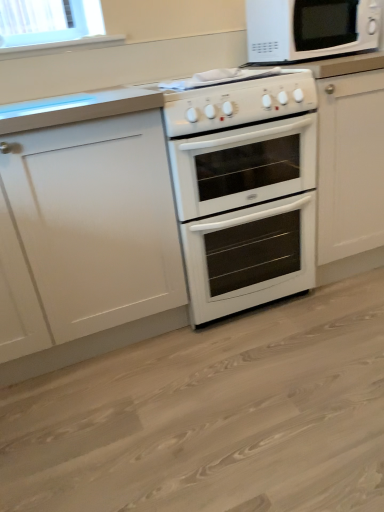
Question: Does white glossy gas stove at center have a lesser width compared to white glossy oven at center?

Choices:
 (A) no
 (B) yes

Answer: (B)

Question: From a real-world perspective, is white glossy gas stove at center physically below white glossy oven at center?

Choices:
 (A) no
 (B) yes

Answer: (A)

Question: Is white glossy gas stove at center located outside white glossy oven at center?

Choices:
 (A) no
 (B) yes

Answer: (B)

Question: Is white glossy gas stove at center far from white glossy oven at center?

Choices:
 (A) no
 (B) yes

Answer: (A)

Question: Can you confirm if white glossy gas stove at center is positioned to the right of white glossy oven at center?

Choices:
 (A) yes
 (B) no

Answer: (B)

Question: Considering the relative positions of white matte cabinet at left and white glossy oven at center in the image provided, is white matte cabinet at left to the left or to the right of white glossy oven at center?

Choices:
 (A) left
 (B) right

Answer: (A)

Question: From the image's perspective, is white matte cabinet at left located above or below white glossy oven at center?

Choices:
 (A) below
 (B) above

Answer: (A)

Question: Is white matte cabinet at left inside the boundaries of white glossy oven at center, or outside?

Choices:
 (A) outside
 (B) inside

Answer: (A)

Question: Considering the positions of point (135, 291) and point (258, 303), is point (135, 291) closer or farther from the camera than point (258, 303)?

Choices:
 (A) closer
 (B) farther

Answer: (A)

Question: Which is correct: white glossy oven at center is inside white glossy oven at center, or outside of it?

Choices:
 (A) outside
 (B) inside

Answer: (A)

Question: From their relative heights in the image, would you say white glossy oven at center is taller or shorter than white glossy oven at center?

Choices:
 (A) short
 (B) tall

Answer: (A)

Question: Based on their positions, is white glossy oven at center located to the left or right of white glossy oven at center?

Choices:
 (A) right
 (B) left

Answer: (A)

Question: Is white glossy oven at center wider or thinner than white glossy oven at center?

Choices:
 (A) wide
 (B) thin

Answer: (A)

Question: From a real-world perspective, is white glossy gas stove at center positioned above or below white glossy microwave at upper right?

Choices:
 (A) below
 (B) above

Answer: (A)

Question: From the image's perspective, is white glossy gas stove at center located above or below white glossy microwave at upper right?

Choices:
 (A) above
 (B) below

Answer: (B)